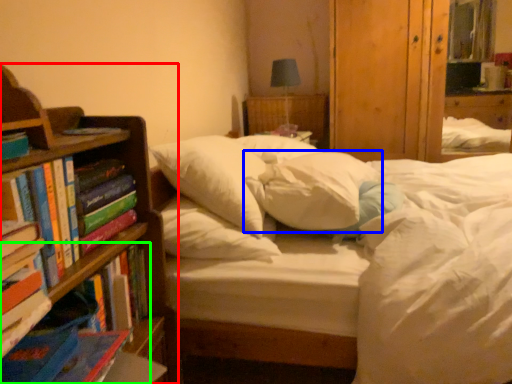
Question: Which is farther away from bookcase (highlighted by a red box)? pillow (highlighted by a blue box) or book (highlighted by a green box)?

Choices:
 (A) pillow
 (B) book

Answer: (A)